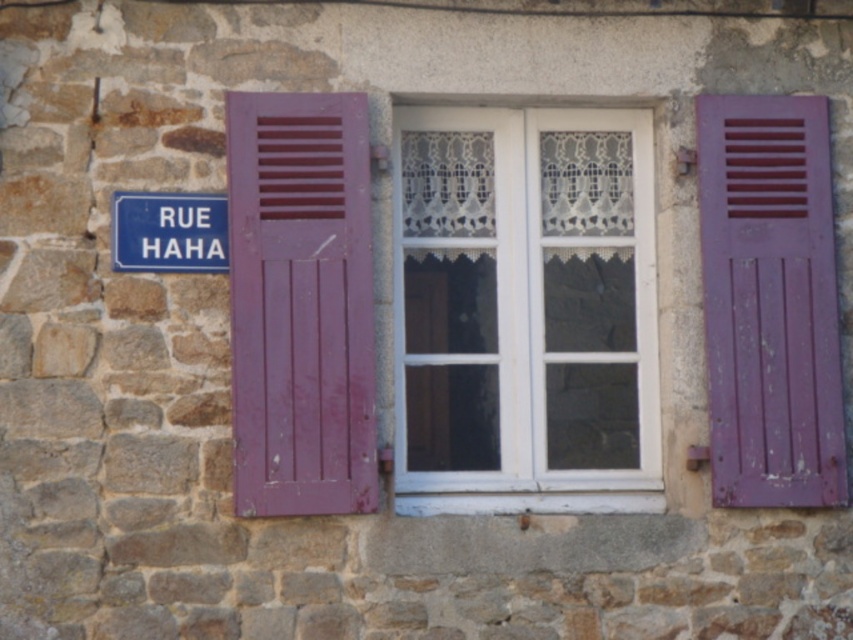
Between white painted wood window frame at center and blue plastic sign at upper left, which one is positioned higher?

blue plastic sign at upper left

Is point (558, 369) less distant than point (115, 234)?

No, it is behind (115, 234).

I want to click on white painted wood window frame at center, so click(525, 310).

Does white painted wood window frame at center appear on the right side of purple matte shutter at left?

Correct, you'll find white painted wood window frame at center to the right of purple matte shutter at left.

Which is more to the left, white painted wood window frame at center or purple matte shutter at left?

From the viewer's perspective, purple matte shutter at left appears more on the left side.

Does point (634, 369) come in front of point (358, 376)?

That is False.

The width and height of the screenshot is (853, 640). I want to click on white painted wood window frame at center, so click(x=525, y=310).

Does purple matte shutter at right have a smaller size compared to blue plastic sign at upper left?

Incorrect, purple matte shutter at right is not smaller in size than blue plastic sign at upper left.

Who is shorter, purple matte shutter at right or blue plastic sign at upper left?

blue plastic sign at upper left

Between point (795, 166) and point (128, 228), which one is positioned behind?

The point (795, 166) is behind.

Locate an element on the screen. The width and height of the screenshot is (853, 640). purple matte shutter at right is located at coordinates 770,301.